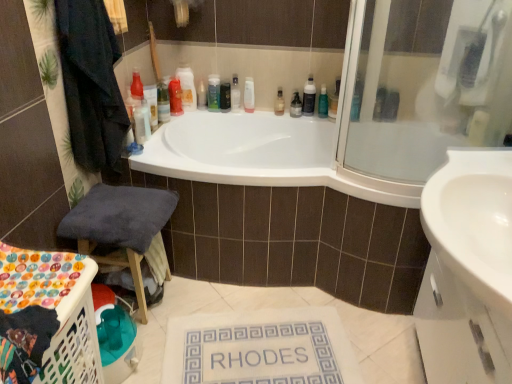
At what (x,y) coordinates should I click in order to perform the action: click on free spot above white fabric bath mat at center (from a real-world perspective). Please return your answer as a coordinate pair (x, y). The height and width of the screenshot is (384, 512). Looking at the image, I should click on (258, 345).